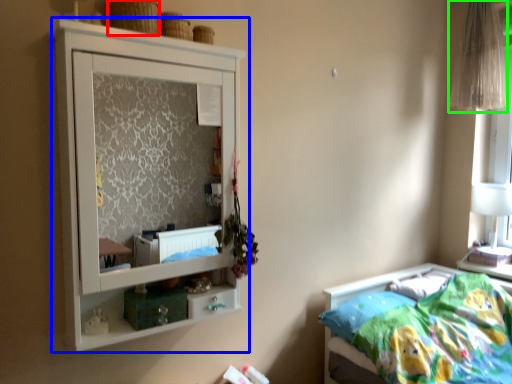
Question: Which is farther away from basket (highlighted by a red box)? cupboard (highlighted by a blue box) or curtain (highlighted by a green box)?

Choices:
 (A) cupboard
 (B) curtain

Answer: (A)